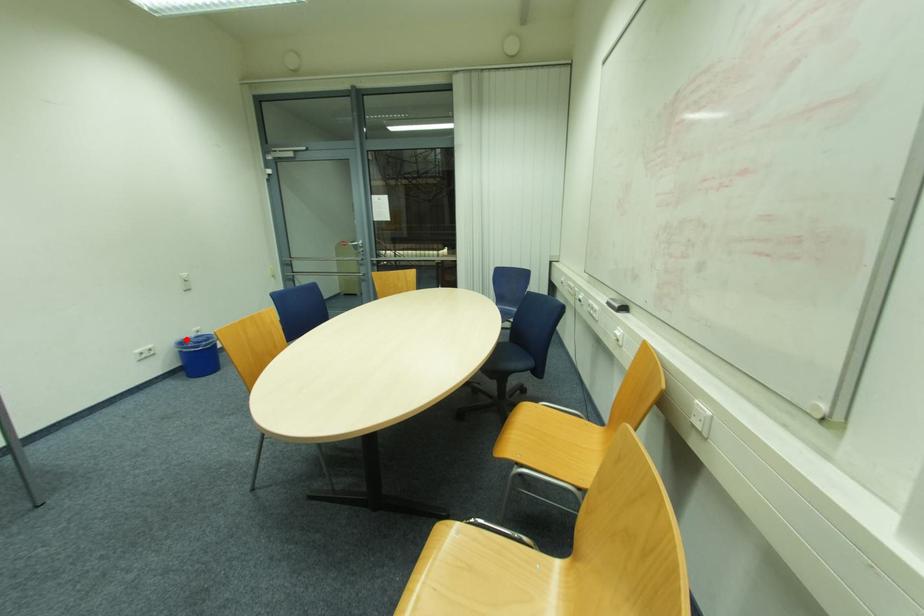
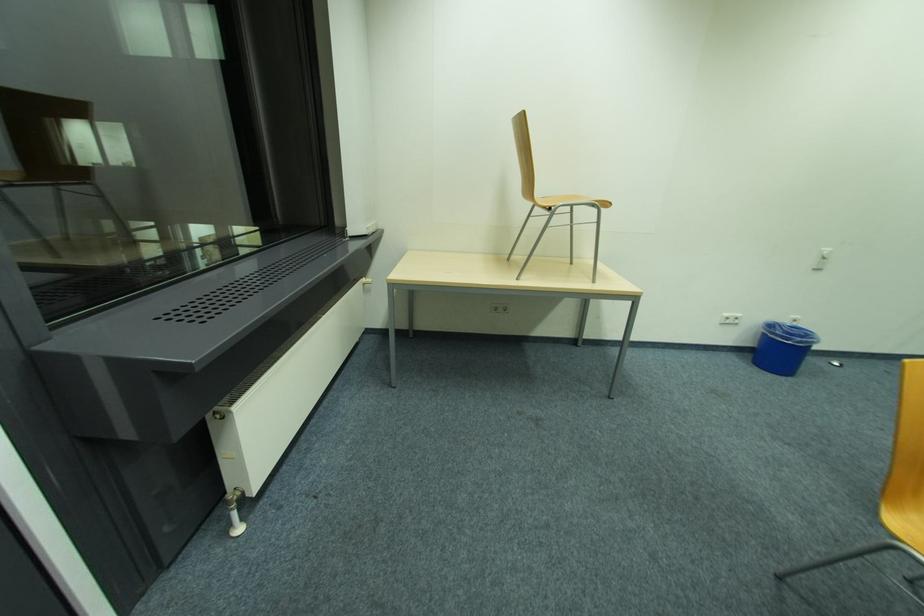
Where in the second image is the point corresponding to the highlighted location from the first image?

(779, 323)